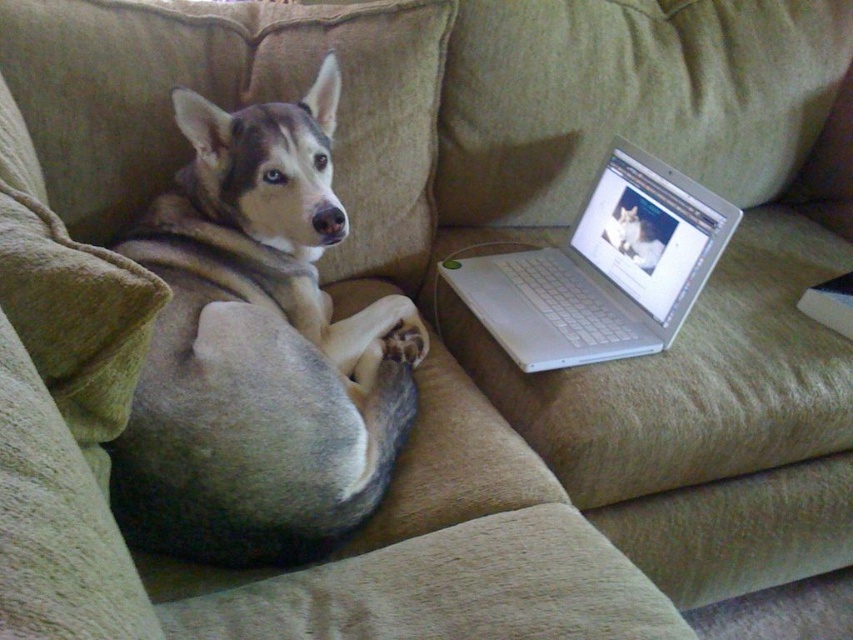
Question: Is brown fur dog at left positioned at the back of silver metallic laptop at right?

Choices:
 (A) no
 (B) yes

Answer: (A)

Question: Which object is closer to the camera taking this photo?

Choices:
 (A) brown fur dog at left
 (B) silver metallic laptop at right

Answer: (A)

Question: Which of the following is the closest to the observer?

Choices:
 (A) (480, 272)
 (B) (323, 60)

Answer: (B)

Question: Does brown fur dog at left appear under silver metallic laptop at right?

Choices:
 (A) no
 (B) yes

Answer: (B)

Question: Is brown fur dog at left to the left of silver metallic laptop at right from the viewer's perspective?

Choices:
 (A) no
 (B) yes

Answer: (B)